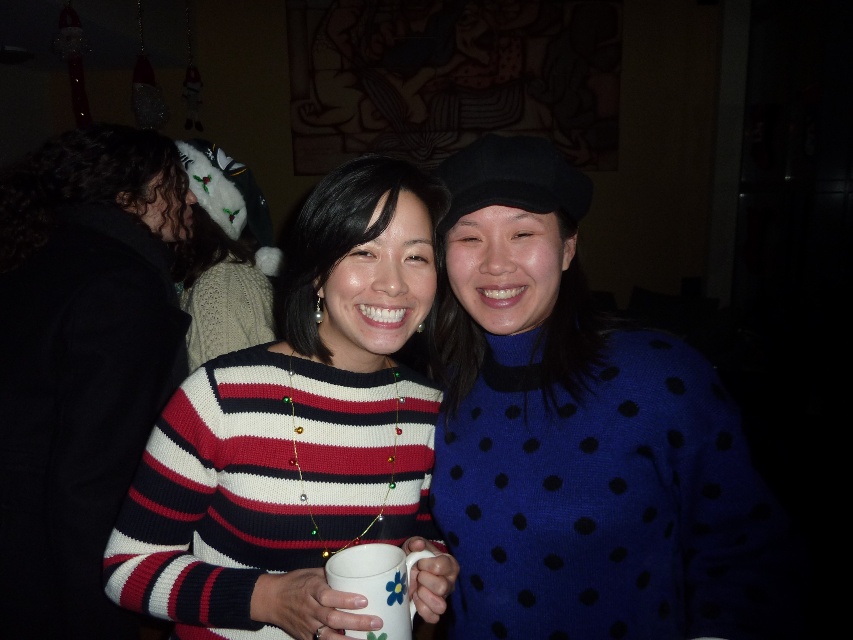
Who is more forward, (395, 541) or (390, 552)?

Point (390, 552) is more forward.

Can you confirm if knitted striped sweater at center is smaller than white glossy mug at center?

No, knitted striped sweater at center is not smaller than white glossy mug at center.

Where is `knitted striped sweater at center`? knitted striped sweater at center is located at coordinates (299, 433).

The width and height of the screenshot is (853, 640). What are the coordinates of `knitted striped sweater at center` in the screenshot? It's located at (299, 433).

Is point (158, 144) farther from viewer compared to point (201, 310)?

That is False.

Find the location of `striped knit sweater at center`. striped knit sweater at center is located at coordinates (80, 362).

Identify the location of striped knit sweater at center. (80, 362).

Is knitted striped sweater at center taller than striped knit sweater at center?

No, knitted striped sweater at center is not taller than striped knit sweater at center.

Which is behind, point (415, 544) or point (151, 292)?

Point (151, 292)

Image resolution: width=853 pixels, height=640 pixels. In order to click on knitted striped sweater at center in this screenshot , I will do `click(299, 433)`.